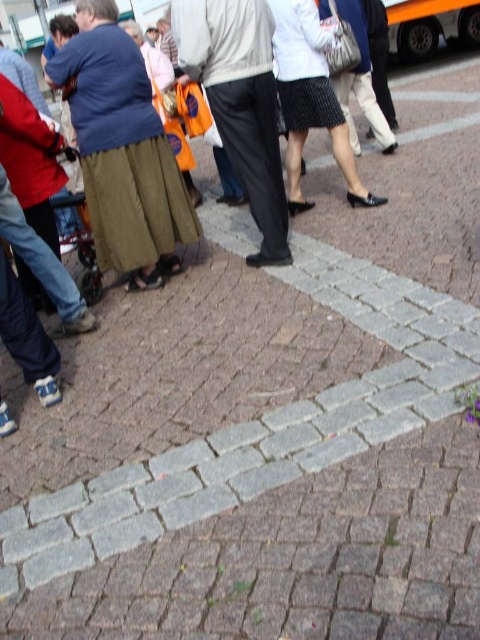
You are a photographer standing at the pedestrian crossing. You notice two skirts in the crowd, the matte olive skirt at left and the black textured skirt at center. Which skirt appears taller from your viewpoint?

The matte olive skirt at left appears taller than the black textured skirt at center from your viewpoint.

You are a photographer standing at the pedestrian crossing. You notice two people walking away from you. One is wearing dark gray pants at center and the other is wearing a black textured skirt at center. Which clothing item is located to the left when viewed from your perspective?

The dark gray pants at center is positioned on the left side of black textured skirt at center, so from your perspective, the dark gray pants at center is to the left.

You are a pedestrian trying to cross the street. You see the matte olive skirt at left and the dark gray pants at center. Which one is closer to you?

The matte olive skirt at left is positioned under the dark gray pants at center, meaning it is closer to you.